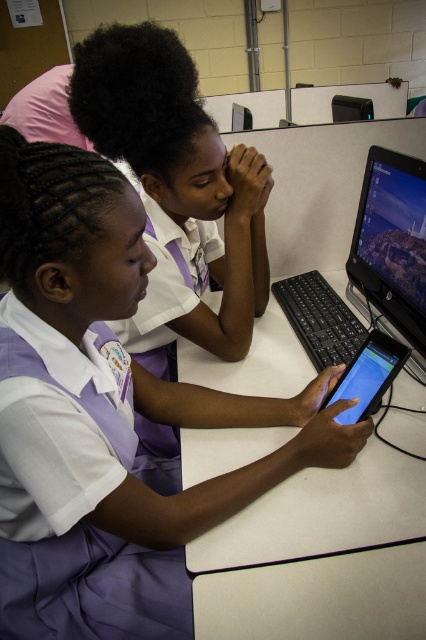
From the picture: Can you confirm if purple fabric uniform at center is bigger than black plastic monitor at center?

Yes, purple fabric uniform at center is bigger than black plastic monitor at center.

Does purple fabric uniform at center have a lesser height compared to black plastic monitor at center?

No.

The height and width of the screenshot is (640, 426). I want to click on purple fabric uniform at center, so click(x=106, y=417).

This screenshot has height=640, width=426. What are the coordinates of `purple fabric uniform at center` in the screenshot? It's located at (106, 417).

Is purple fabric uniform at center to the left of purple fabric school uniform at lower left from the viewer's perspective?

No, purple fabric uniform at center is not to the left of purple fabric school uniform at lower left.

Is purple fabric uniform at center closer to camera compared to purple fabric school uniform at lower left?

Yes, it is in front of purple fabric school uniform at lower left.

Describe the element at coordinates (106, 417) in the screenshot. I see `purple fabric uniform at center` at that location.

The image size is (426, 640). Identify the location of purple fabric uniform at center. (106, 417).

Does purple fabric uniform at center have a lesser width compared to black glossy tablet at center?

In fact, purple fabric uniform at center might be wider than black glossy tablet at center.

Is purple fabric uniform at center further to camera compared to black glossy tablet at center?

No, it is not.

Who is more distant from viewer, (51, 417) or (362, 385)?

Point (362, 385)

You are a GUI agent. You are given a task and a screenshot of the screen. Output one action in this format:
    pyautogui.click(x=<x>, y=<y>)
    Task: Click on the purple fabric uniform at center
    This screenshot has width=426, height=640.
    Given the screenshot: What is the action you would take?
    pyautogui.click(x=106, y=417)